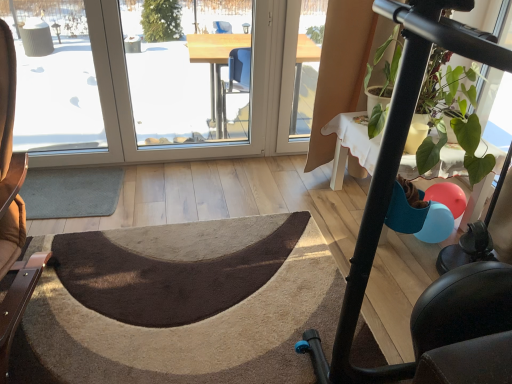
Question: Does gray carpet at lower left, the second doormat ordered from the bottom, have a greater width compared to green matte plant at right?

Choices:
 (A) yes
 (B) no

Answer: (B)

Question: Is gray carpet at lower left, which is the first doormat in top-to-bottom order, surrounding green matte plant at right?

Choices:
 (A) no
 (B) yes

Answer: (A)

Question: From a real-world perspective, is gray carpet at lower left, the second doormat ordered from the bottom, over green matte plant at right?

Choices:
 (A) no
 (B) yes

Answer: (A)

Question: From the image's perspective, does gray carpet at lower left, the second doormat ordered from the bottom, appear lower than green matte plant at right?

Choices:
 (A) no
 (B) yes

Answer: (B)

Question: Is green matte plant at right at the back of gray carpet at lower left, which is the first doormat in top-to-bottom order?

Choices:
 (A) yes
 (B) no

Answer: (B)

Question: Looking at the image, does transparent glass window at center, marked as the 1th window screen in a right-to-left arrangement, seem bigger or smaller compared to green matte plant at right?

Choices:
 (A) big
 (B) small

Answer: (B)

Question: From a real-world perspective, relative to green matte plant at right, is transparent glass window at center, marked as the 1th window screen in a right-to-left arrangement, vertically above or below?

Choices:
 (A) above
 (B) below

Answer: (B)

Question: In terms of width, does transparent glass window at center, marked as the 1th window screen in a right-to-left arrangement, look wider or thinner when compared to green matte plant at right?

Choices:
 (A) thin
 (B) wide

Answer: (A)

Question: From the image's perspective, is transparent glass window at center, marked as the second window screen in a left-to-right arrangement, located above or below green matte plant at right?

Choices:
 (A) below
 (B) above

Answer: (B)

Question: From a real-world perspective, relative to brown leather chair at left, is green matte plant at right vertically above or below?

Choices:
 (A) above
 (B) below

Answer: (A)

Question: Looking at their shapes, would you say green matte plant at right is wider or thinner than brown leather chair at left?

Choices:
 (A) thin
 (B) wide

Answer: (A)

Question: Looking at the image, does green matte plant at right seem bigger or smaller compared to brown leather chair at left?

Choices:
 (A) big
 (B) small

Answer: (B)

Question: Considering their positions, is green matte plant at right located in front of or behind brown leather chair at left?

Choices:
 (A) behind
 (B) front

Answer: (A)

Question: From a real-world perspective, is gray carpet at lower left, the second doormat ordered from the bottom, positioned above or below transparent glass window at upper left, the 1th window screen viewed from the left?

Choices:
 (A) above
 (B) below

Answer: (B)

Question: Would you say gray carpet at lower left, the second doormat ordered from the bottom, is inside or outside transparent glass window at upper left, the second window screen positioned from the right?

Choices:
 (A) inside
 (B) outside

Answer: (B)